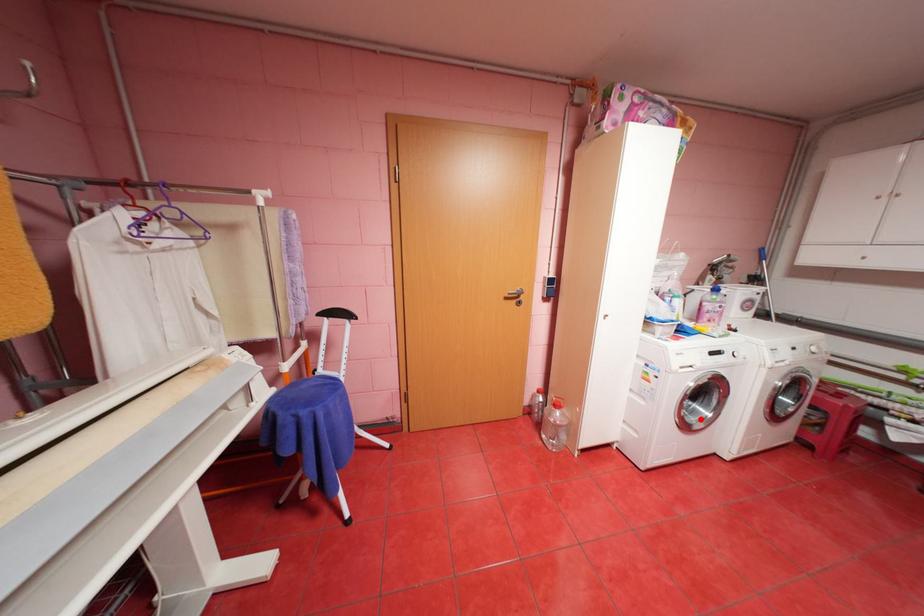
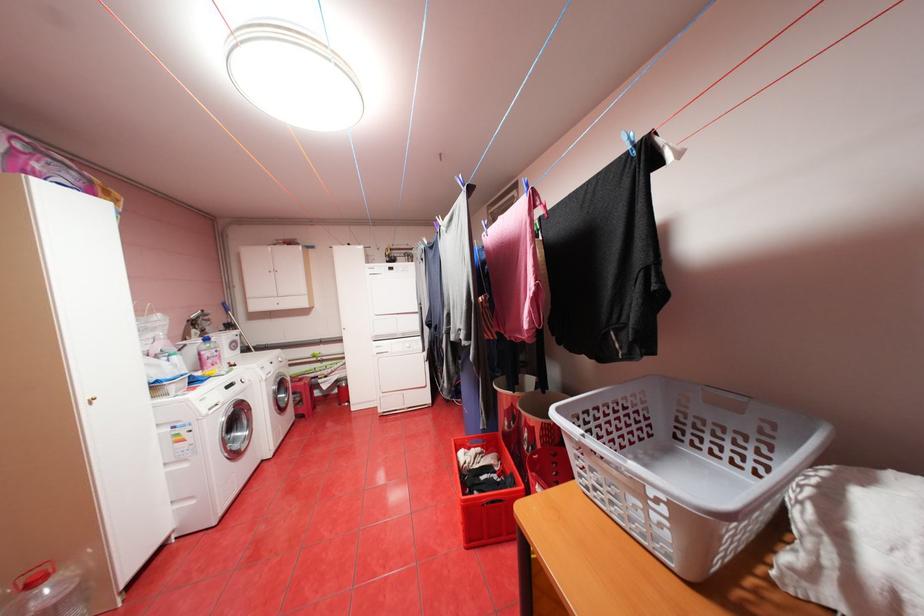
Where in the second image is the point corresponding to the highlighted location from the first image?

(245, 446)